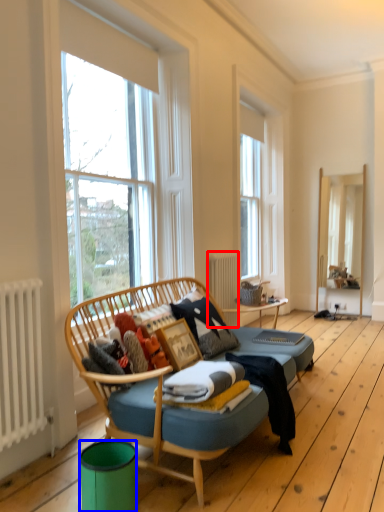
Question: Which point is further to the camera, radiator (highlighted by a red box) or trash bin/can (highlighted by a blue box)?

Choices:
 (A) radiator
 (B) trash bin/can

Answer: (A)